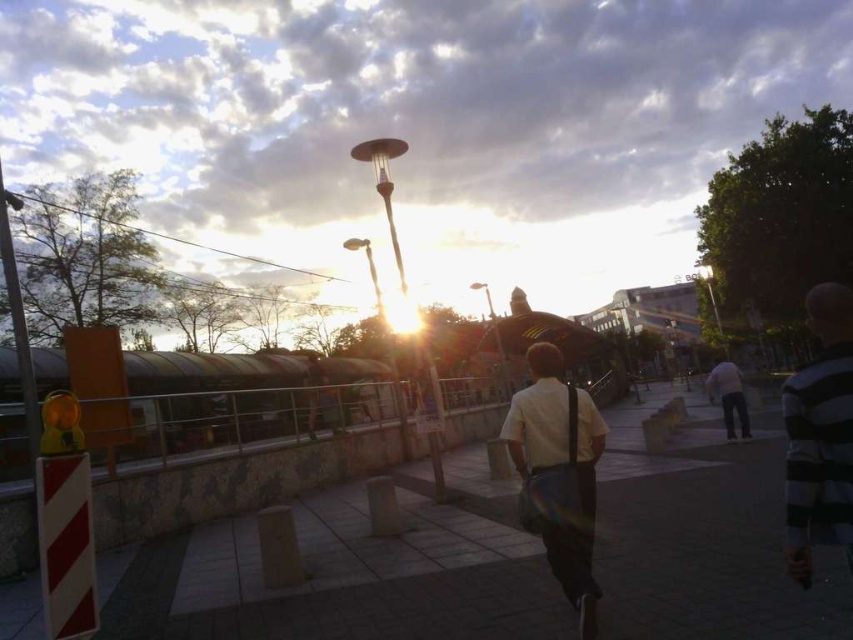
Question: Does striped cotton shirt at right appear on the left side of light gray jeans at center right?

Choices:
 (A) yes
 (B) no

Answer: (A)

Question: Which of these objects is positioned farthest from the striped cotton shirt at right?

Choices:
 (A) white matte shirt at center
 (B) light gray jeans at center right

Answer: (B)

Question: Can you confirm if white matte shirt at center is smaller than light gray jeans at center right?

Choices:
 (A) no
 (B) yes

Answer: (B)

Question: Which object appears farthest from the camera in this image?

Choices:
 (A) light gray jeans at center right
 (B) striped cotton shirt at right
 (C) white matte shirt at center

Answer: (A)

Question: Is white matte shirt at center further to the viewer compared to light gray jeans at center right?

Choices:
 (A) no
 (B) yes

Answer: (A)

Question: Which point is closer to the camera taking this photo?

Choices:
 (A) (732, 417)
 (B) (807, 570)
 (C) (561, 528)

Answer: (B)